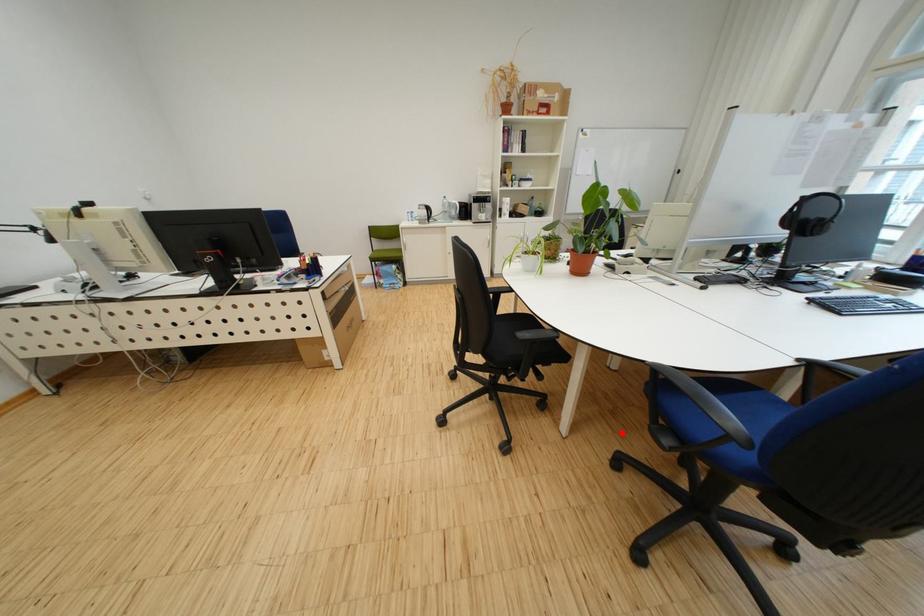
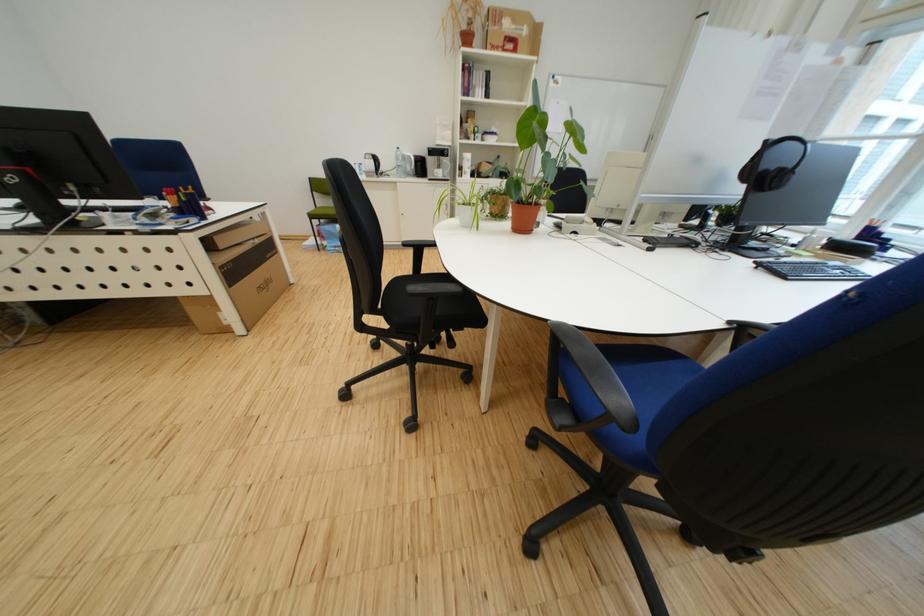
Locate, in the second image, the point that corresponds to the highlighted location in the first image.

(548, 408)